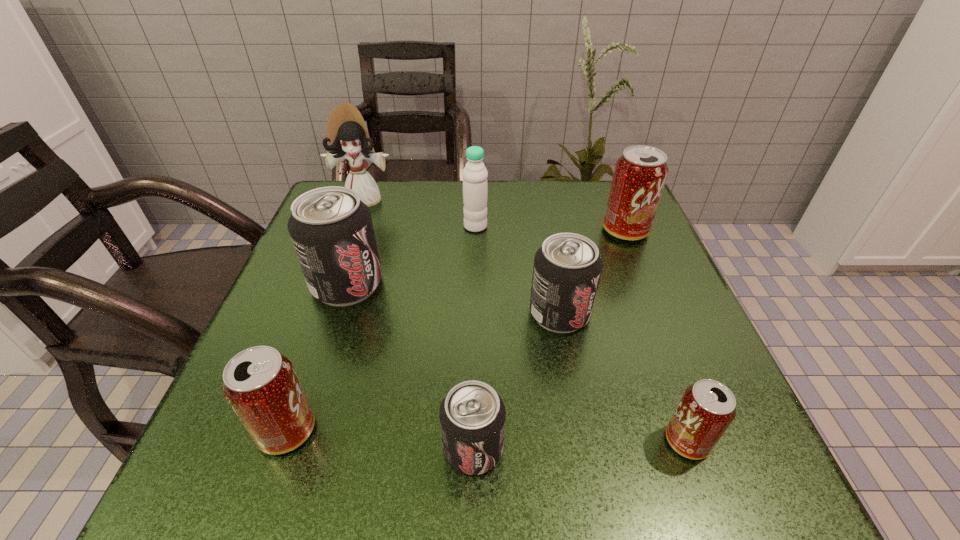
Identify which object is the third closest to the biggest red soda can. Please provide its 2D coordinates. Your answer should be formatted as a tuple, i.e. [(x, y)], where the tuple contains the x and y coordinates of a point satisfying the conditions above.

[(707, 408)]

Select which object is the third closest to the biggest black soda can. Please provide its 2D coordinates. Your answer should be formatted as a tuple, i.e. [(x, y)], where the tuple contains the x and y coordinates of a point satisfying the conditions above.

[(260, 384)]

Locate an element on the screen. The height and width of the screenshot is (540, 960). soda can identified as the second closest to the smallest red soda can is located at coordinates (472, 415).

Where is `the third closest soda can to the second biggest red soda can`? The image size is (960, 540). the third closest soda can to the second biggest red soda can is located at coordinates (567, 268).

Identify which red soda can is the second nearest to the biggest black soda can. Please provide its 2D coordinates. Your answer should be formatted as a tuple, i.e. [(x, y)], where the tuple contains the x and y coordinates of a point satisfying the conditions above.

[(640, 174)]

Identify the location of red soda can that is the third closest to the biggest black soda can. (707, 408).

Locate which black soda can ranks in proximity to the leftmost black soda can. Please provide its 2D coordinates. Your answer should be formatted as a tuple, i.e. [(x, y)], where the tuple contains the x and y coordinates of a point satisfying the conditions above.

[(472, 415)]

Where is `black soda can that is the third closest to the farthest soda can`? This screenshot has width=960, height=540. black soda can that is the third closest to the farthest soda can is located at coordinates (472, 415).

Where is `vacant point that satisfies the following two spatial constraints: 1. on the front side of the leftmost black soda can; 2. on the left side of the nearest black soda can`? The image size is (960, 540). vacant point that satisfies the following two spatial constraints: 1. on the front side of the leftmost black soda can; 2. on the left side of the nearest black soda can is located at coordinates (294, 448).

This screenshot has width=960, height=540. In order to click on free space in the image that satisfies the following two spatial constraints: 1. on the front side of the smallest red soda can; 2. on the left side of the sixth object from left to right in this screenshot , I will do `click(583, 441)`.